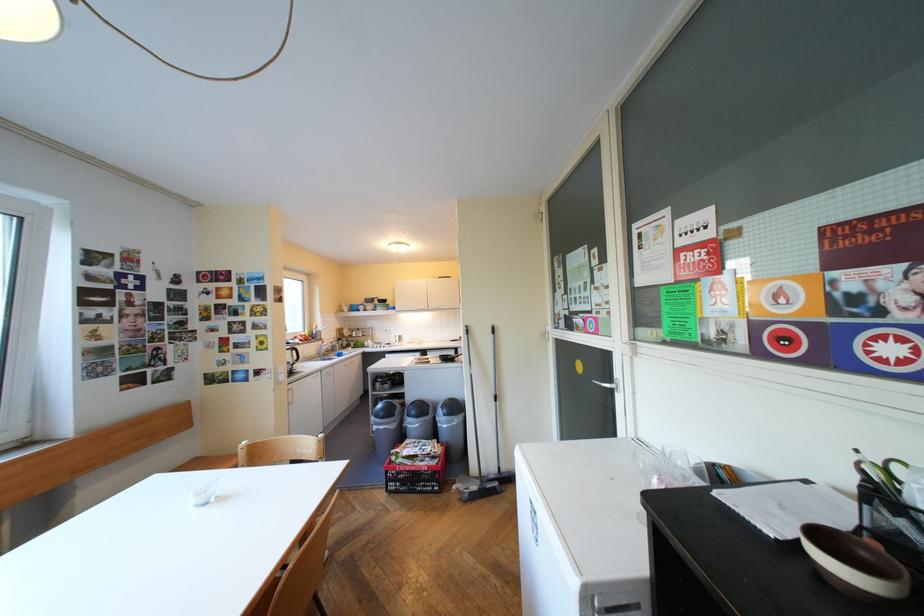
Locate an element on the screen. The height and width of the screenshot is (616, 924). dustpan handle is located at coordinates (473, 397).